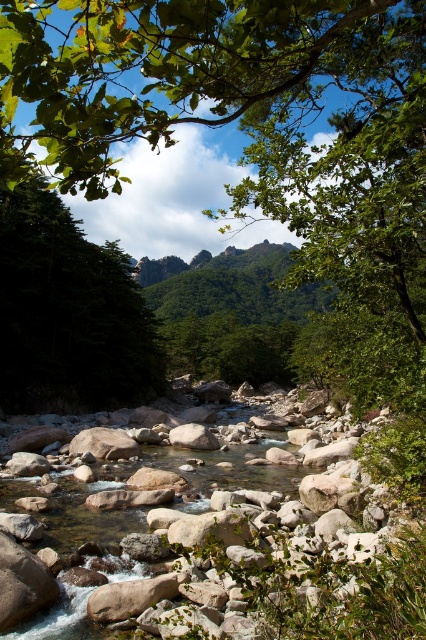
Question: Where is green leafy tree at upper center located in relation to green matte tree at left in the image?

Choices:
 (A) left
 (B) right

Answer: (A)

Question: Which of the following is the farthest from the observer?

Choices:
 (A) (58, 145)
 (B) (48, 209)

Answer: (B)

Question: Does green leafy tree at upper center have a larger size compared to green matte tree at left?

Choices:
 (A) no
 (B) yes

Answer: (B)

Question: Which point is closer to the camera?

Choices:
 (A) green matte tree at left
 (B) green leafy tree at upper center

Answer: (B)

Question: Is green leafy tree at upper center positioned before green matte tree at left?

Choices:
 (A) no
 (B) yes

Answer: (B)